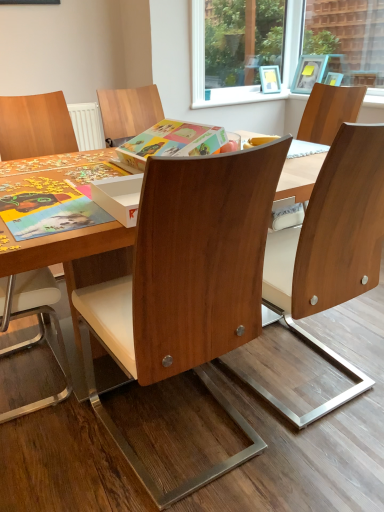
In order to face wooden chair at center, the 2th chair in the left-to-right sequence, should I rotate leftwards or rightwards?

To align with it, rotate left about 4.486°.

What do you see at coordinates (187, 285) in the screenshot?
I see `wooden chair at center, arranged as the second chair when viewed from the right` at bounding box center [187, 285].

The image size is (384, 512). Describe the element at coordinates (309, 73) in the screenshot. I see `wooden picture frame at upper right` at that location.

Describe the element at coordinates (172, 142) in the screenshot. The height and width of the screenshot is (512, 384). I see `matte cardboard book at center` at that location.

Describe the element at coordinates (337, 250) in the screenshot. I see `wooden chair at center, the first chair viewed from the right` at that location.

The height and width of the screenshot is (512, 384). Identify the location of wooden chair at center, the 2th chair in the left-to-right sequence. (187, 285).

Looking at this image, which of these two, wooden chair at center, acting as the 3th chair starting from the left, or matte cardboard book at center, is smaller?

matte cardboard book at center.

In terms of width, does wooden chair at center, acting as the 3th chair starting from the left, look wider or thinner when compared to matte cardboard book at center?

In the image, wooden chair at center, acting as the 3th chair starting from the left, appears to be wider than matte cardboard book at center.

I want to click on book above the wooden chair at center, acting as the 3th chair starting from the left (from the image's perspective), so click(x=172, y=142).

From the image's perspective, is wooden chair at center, acting as the 3th chair starting from the left, over matte cardboard book at center?

No, from the image's perspective, wooden chair at center, acting as the 3th chair starting from the left, is not over matte cardboard book at center.

Is wooden picture frame at upper right facing towards matte cardboard book at center?

Yes, wooden picture frame at upper right faces towards matte cardboard book at center.

From the picture: Considering the sizes of objects wooden picture frame at upper right and matte cardboard book at center in the image provided, who is wider, wooden picture frame at upper right or matte cardboard book at center?

Wider between the two is matte cardboard book at center.

Considering the relative positions of wooden picture frame at upper right and matte cardboard book at center in the image provided, is wooden picture frame at upper right to the right of matte cardboard book at center from the viewer's perspective?

Correct, you'll find wooden picture frame at upper right to the right of matte cardboard book at center.

Considering the relative sizes of wooden chair at center, arranged as the second chair when viewed from the right, and wooden picture frame at upper right in the image provided, is wooden chair at center, arranged as the second chair when viewed from the right, wider than wooden picture frame at upper right?

Yes.

Looking at this image, from a real-world perspective, which is physically below, wooden chair at center, arranged as the second chair when viewed from the right, or wooden picture frame at upper right?

wooden chair at center, arranged as the second chair when viewed from the right.

Considering the relative sizes of wooden chair at center, the 2th chair in the left-to-right sequence, and wooden picture frame at upper right in the image provided, is wooden chair at center, the 2th chair in the left-to-right sequence, shorter than wooden picture frame at upper right?

Incorrect, the height of wooden chair at center, the 2th chair in the left-to-right sequence, does not fall short of that of wooden picture frame at upper right.

Locate an element on the screen. the 2nd chair counting from the left side of the wooden picture frame at upper right is located at coordinates (187, 285).

Considering the positions of objects matte cardboard book at center and wooden picture frame at upper right in the image provided, who is more to the left, matte cardboard book at center or wooden picture frame at upper right?

From the viewer's perspective, matte cardboard book at center appears more on the left side.

Could you tell me if matte cardboard book at center is facing wooden picture frame at upper right?

Yes, matte cardboard book at center is oriented towards wooden picture frame at upper right.

In the scene shown: Is there a large distance between matte cardboard book at center and wooden picture frame at upper right?

Yes, matte cardboard book at center and wooden picture frame at upper right are located far from each other.

Is wooden chair at center, arranged as the second chair when viewed from the right, surrounded by wooden chair at left, the 1th chair in the left-to-right sequence?

No, wooden chair at center, arranged as the second chair when viewed from the right, is not a part of wooden chair at left, the 1th chair in the left-to-right sequence.

From a real-world perspective, is wooden chair at left, which is the 3th chair in right-to-left order, under wooden chair at center, arranged as the second chair when viewed from the right?

Indeed, from a real-world perspective, wooden chair at left, which is the 3th chair in right-to-left order, is positioned beneath wooden chair at center, arranged as the second chair when viewed from the right.

Measure the distance between wooden chair at left, the 1th chair in the left-to-right sequence, and wooden chair at center, arranged as the second chair when viewed from the right.

They are 1.30 meters apart.

Which is farther, (62, 344) or (188, 296)?

The point (62, 344) is farther from the camera.

Is wooden chair at center, the 2th chair in the left-to-right sequence, to the left or to the right of matte cardboard book at center in the image?

Clearly, wooden chair at center, the 2th chair in the left-to-right sequence, is on the left of matte cardboard book at center in the image.

Does wooden chair at center, the 2th chair in the left-to-right sequence, turn towards matte cardboard book at center?

No, wooden chair at center, the 2th chair in the left-to-right sequence, is not aimed at matte cardboard book at center.

From the image's perspective, is wooden chair at center, arranged as the second chair when viewed from the right, above matte cardboard book at center?

No, from the image's perspective, wooden chair at center, arranged as the second chair when viewed from the right, is not above matte cardboard book at center.

In the scene shown: Is wooden chair at left, which is the 3th chair in right-to-left order, beside wooden picture frame at upper right?

No, wooden chair at left, which is the 3th chair in right-to-left order, is not in contact with wooden picture frame at upper right.

Based on the photo, who is bigger, wooden chair at left, the 1th chair in the left-to-right sequence, or wooden picture frame at upper right?

wooden chair at left, the 1th chair in the left-to-right sequence, is bigger.

Where is `picture frame lying on the right of wooden chair at left, which is the 3th chair in right-to-left order`? picture frame lying on the right of wooden chair at left, which is the 3th chair in right-to-left order is located at coordinates (309, 73).

Which is more to the left, wooden chair at left, the 1th chair in the left-to-right sequence, or wooden picture frame at upper right?

wooden chair at left, the 1th chair in the left-to-right sequence, is more to the left.

Where is `chair that is the 1st one when counting downward from the matte cardboard book at center (from the image's perspective)`? chair that is the 1st one when counting downward from the matte cardboard book at center (from the image's perspective) is located at coordinates (337, 250).

Locate an element on the screen. book below the wooden picture frame at upper right (from a real-world perspective) is located at coordinates (172, 142).

Consider the image. When comparing their distances from matte cardboard book at center, does wooden picture frame at upper right or wooden chair at left, the 1th chair in the left-to-right sequence, seem closer?

wooden chair at left, the 1th chair in the left-to-right sequence, lies closer to matte cardboard book at center than the other object.

Looking at the image, which one is located further to wooden chair at center, acting as the 3th chair starting from the left, wooden picture frame at upper right or matte cardboard book at center?

Based on the image, wooden picture frame at upper right appears to be further to wooden chair at center, acting as the 3th chair starting from the left.

When comparing their distances from wooden chair at left, which is the 3th chair in right-to-left order, does matte cardboard book at center or wooden chair at center, acting as the 3th chair starting from the left, seem further?

Based on the image, wooden chair at center, acting as the 3th chair starting from the left, appears to be further to wooden chair at left, which is the 3th chair in right-to-left order.

Which object lies further to the anchor point wooden picture frame at upper right, wooden chair at center, acting as the 3th chair starting from the left, or wooden chair at left, the 1th chair in the left-to-right sequence?

The object further to wooden picture frame at upper right is wooden chair at center, acting as the 3th chair starting from the left.

Based on their spatial positions, is wooden chair at center, the first chair viewed from the right, or matte cardboard book at center further from wooden picture frame at upper right?

wooden chair at center, the first chair viewed from the right, is positioned further to the anchor wooden picture frame at upper right.

Based on their spatial positions, is wooden chair at center, the first chair viewed from the right, or wooden chair at center, arranged as the second chair when viewed from the right, closer to wooden picture frame at upper right?

Among the two, wooden chair at center, the first chair viewed from the right, is located nearer to wooden picture frame at upper right.

Looking at the image, which one is located further to wooden picture frame at upper right, matte cardboard book at center or wooden chair at center, arranged as the second chair when viewed from the right?

Among the two, wooden chair at center, arranged as the second chair when viewed from the right, is located further to wooden picture frame at upper right.

Looking at the image, which one is located closer to matte cardboard book at center, wooden chair at center, the first chair viewed from the right, or wooden chair at left, which is the 3th chair in right-to-left order?

wooden chair at center, the first chair viewed from the right, is closer to matte cardboard book at center.

The width and height of the screenshot is (384, 512). What are the coordinates of `chair located between wooden chair at left, the 1th chair in the left-to-right sequence, and wooden chair at center, the first chair viewed from the right, in the left-right direction` in the screenshot? It's located at (187, 285).

Locate an element on the screen. This screenshot has height=512, width=384. chair between wooden chair at center, acting as the 3th chair starting from the left, and wooden picture frame at upper right from front to back is located at coordinates (35, 126).

This screenshot has height=512, width=384. Find the location of `book between wooden chair at left, which is the 3th chair in right-to-left order, and wooden picture frame at upper right in the front-back direction`. book between wooden chair at left, which is the 3th chair in right-to-left order, and wooden picture frame at upper right in the front-back direction is located at coordinates (172, 142).

Locate an element on the screen. book between wooden chair at center, the first chair viewed from the right, and wooden picture frame at upper right from front to back is located at coordinates (172, 142).